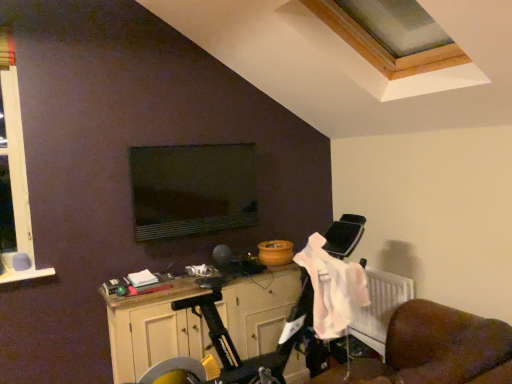
Question: From a real-world perspective, is wooden cabinet at lower center physically below matte black monitor at center?

Choices:
 (A) yes
 (B) no

Answer: (A)

Question: Is wooden cabinet at lower center far from matte black monitor at center?

Choices:
 (A) yes
 (B) no

Answer: (B)

Question: From a real-world perspective, is wooden cabinet at lower center positioned over matte black monitor at center based on gravity?

Choices:
 (A) no
 (B) yes

Answer: (A)

Question: Would you say wooden cabinet at lower center is outside matte black monitor at center?

Choices:
 (A) no
 (B) yes

Answer: (B)

Question: Considering the relative positions of wooden cabinet at lower center and matte black monitor at center in the image provided, is wooden cabinet at lower center to the left of matte black monitor at center from the viewer's perspective?

Choices:
 (A) no
 (B) yes

Answer: (A)

Question: Looking at their shapes, would you say wooden cabinet at lower center is wider or thinner than pink fabric at lower right?

Choices:
 (A) thin
 (B) wide

Answer: (B)

Question: Considering the positions of point (156, 349) and point (332, 296), is point (156, 349) closer or farther from the camera than point (332, 296)?

Choices:
 (A) farther
 (B) closer

Answer: (A)

Question: Considering the positions of wooden cabinet at lower center and pink fabric at lower right in the image, is wooden cabinet at lower center taller or shorter than pink fabric at lower right?

Choices:
 (A) tall
 (B) short

Answer: (A)

Question: Is wooden cabinet at lower center inside or outside of pink fabric at lower right?

Choices:
 (A) outside
 (B) inside

Answer: (A)

Question: From the image's perspective, is matte black monitor at center located above or below pink fabric at lower right?

Choices:
 (A) above
 (B) below

Answer: (A)

Question: Is matte black monitor at center inside or outside of pink fabric at lower right?

Choices:
 (A) outside
 (B) inside

Answer: (A)

Question: In the image, is matte black monitor at center on the left side or the right side of pink fabric at lower right?

Choices:
 (A) left
 (B) right

Answer: (A)

Question: From a real-world perspective, is matte black monitor at center above or below pink fabric at lower right?

Choices:
 (A) below
 (B) above

Answer: (B)

Question: Is pink fabric at lower right inside the boundaries of wooden cabinet at lower center, or outside?

Choices:
 (A) outside
 (B) inside

Answer: (A)

Question: From their relative heights in the image, would you say pink fabric at lower right is taller or shorter than wooden cabinet at lower center?

Choices:
 (A) short
 (B) tall

Answer: (A)